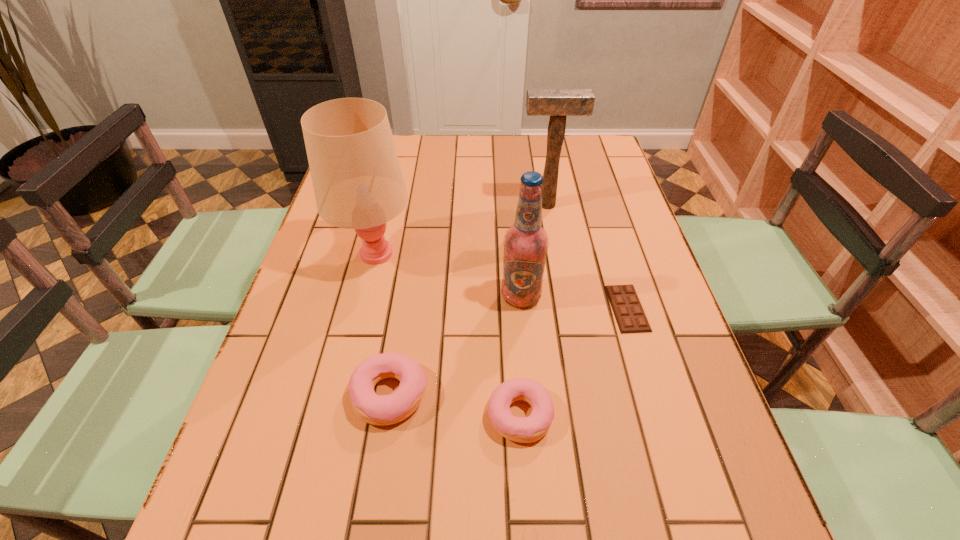
Locate an element on the screen. Image resolution: width=960 pixels, height=540 pixels. vacant space at the far left corner of the desktop is located at coordinates (399, 137).

Identify the location of vacant space at the near left corner of the desktop. (309, 458).

You are a GUI agent. You are given a task and a screenshot of the screen. Output one action in this format:
    pyautogui.click(x=<x>, y=<y>)
    Task: Click on the free space at the far right corner
    This screenshot has width=960, height=540.
    Given the screenshot: What is the action you would take?
    pyautogui.click(x=611, y=155)

I want to click on free space between the fifth tallest object and the left doughnut, so click(455, 404).

Locate an element on the screen. The height and width of the screenshot is (540, 960). free spot between the shortest object and the left doughnut is located at coordinates (509, 351).

This screenshot has width=960, height=540. In order to click on free space between the left doughnut and the rightmost object in this screenshot , I will do `click(509, 351)`.

At what (x,y) coordinates should I click in order to perform the action: click on free space between the shortest object and the mallet. Please return your answer as a coordinate pair (x, y). The height and width of the screenshot is (540, 960). Looking at the image, I should click on (587, 256).

Locate an element on the screen. The image size is (960, 540). free space that is in between the right doughnut and the taller doughnut is located at coordinates (455, 404).

Where is `free area in between the lampshade and the farthest object`? free area in between the lampshade and the farthest object is located at coordinates (461, 230).

Locate an element on the screen. The height and width of the screenshot is (540, 960). free space between the rightmost object and the mallet is located at coordinates (587, 256).